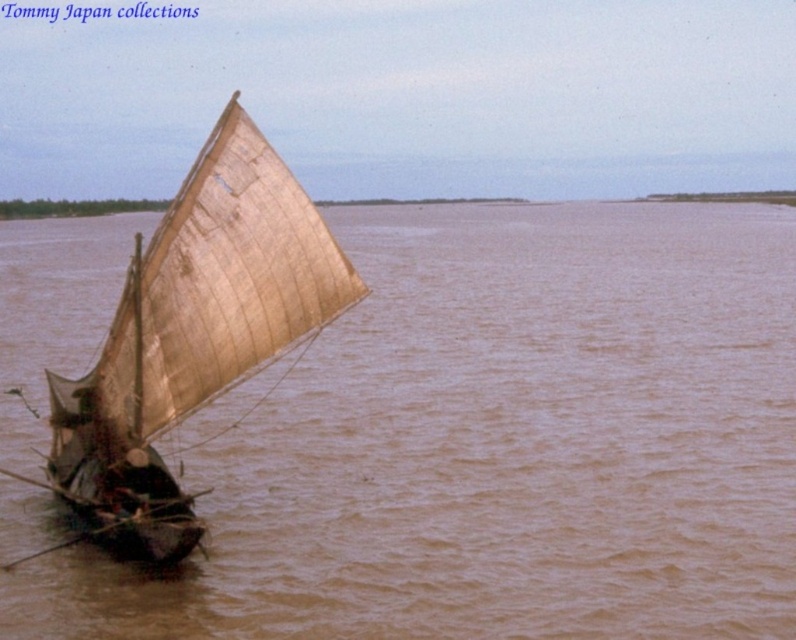
Between brown muddy water at center and light brown canvas sailboat at left, which one appears on the left side from the viewer's perspective?

light brown canvas sailboat at left

Is brown muddy water at center to the left of light brown canvas sailboat at left from the viewer's perspective?

No, brown muddy water at center is not to the left of light brown canvas sailboat at left.

The width and height of the screenshot is (796, 640). Find the location of `brown muddy water at center`. brown muddy water at center is located at coordinates (498, 445).

This screenshot has height=640, width=796. Find the location of `brown muddy water at center`. brown muddy water at center is located at coordinates (498, 445).